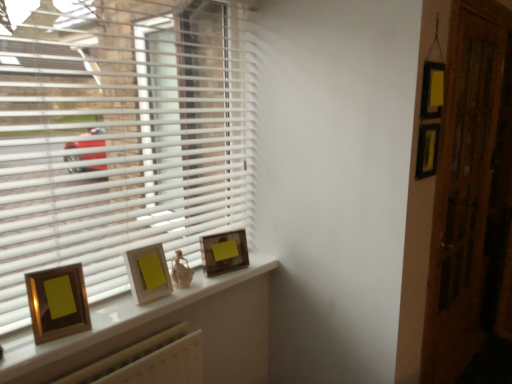
Find the location of a particular element. wooden screen door at right is located at coordinates (471, 192).

In order to face white plastic blinds at left, should I rotate leftwards or rightwards?

Turn left approximately 14.946 degrees to face it.

At what (x,y) coordinates should I click in order to perform the action: click on matte gold picture frame at center, placed as the 3th picture frame when sorted from left to right. Please return your answer as a coordinate pair (x, y). Looking at the image, I should click on (224, 252).

Image resolution: width=512 pixels, height=384 pixels. What do you see at coordinates (58, 302) in the screenshot?
I see `wooden glossy picture frame at left, which is counted as the 3th picture frame, starting from the back` at bounding box center [58, 302].

Identify the location of gold-framed picture at center. (163, 328).

You are a GUI agent. You are given a task and a screenshot of the screen. Output one action in this format:
    pyautogui.click(x=<x>, y=<y>)
    Task: Click on the wooden screen door at right
    The image size is (512, 384).
    Given the screenshot: What is the action you would take?
    pyautogui.click(x=471, y=192)

From a real-world perspective, who is located higher, wooden screen door at right or matte gold picture frame at center, marked as the 2th picture frame in a left-to-right arrangement?

wooden screen door at right.

How much distance is there between wooden screen door at right and matte gold picture frame at center, which appears as the 2th picture frame when viewed from the right?

wooden screen door at right is 1.58 meters from matte gold picture frame at center, which appears as the 2th picture frame when viewed from the right.

Is point (477, 74) positioned after point (134, 256)?

Yes.

Is wooden screen door at right in front of or behind matte gold picture frame at center, which is the 2th picture frame in back-to-front order, in the image?

wooden screen door at right is positioned farther from the viewer than matte gold picture frame at center, which is the 2th picture frame in back-to-front order.

From the image's perspective, which one is positioned higher, matte gold picture frame at center, the first picture frame from the back, or wooden screen door at right?

wooden screen door at right appears higher in the image.

Would you say matte gold picture frame at center, the first picture frame from the back, contains wooden screen door at right?

No, wooden screen door at right is not surrounded by matte gold picture frame at center, the first picture frame from the back.

Who is shorter, matte gold picture frame at center, the first picture frame from the back, or wooden screen door at right?

Standing shorter between the two is matte gold picture frame at center, the first picture frame from the back.

Is matte gold picture frame at center, the first picture frame from the back, not near wooden screen door at right?

That's right, there is a large distance between matte gold picture frame at center, the first picture frame from the back, and wooden screen door at right.

Considering the points (76, 356) and (82, 308), which point is behind, point (76, 356) or point (82, 308)?

Point (82, 308)

From the image's perspective, between gold-framed picture at center and wooden glossy picture frame at left, the 1th picture frame viewed from the front, which one is located above?

From the image's view, wooden glossy picture frame at left, the 1th picture frame viewed from the front, is above.

Is gold-framed picture at center facing towards wooden glossy picture frame at left, which is counted as the first picture frame, starting from the left?

No.

What's the angular difference between gold-framed picture at center and wooden glossy picture frame at left, which is the 3th picture frame from right to left,'s facing directions?

The angular difference between gold-framed picture at center and wooden glossy picture frame at left, which is the 3th picture frame from right to left, is 17.3 degrees.

Which is correct: matte gold picture frame at center, which appears as the 2th picture frame when viewed from the right, is inside white plastic blinds at left, or outside of it?

matte gold picture frame at center, which appears as the 2th picture frame when viewed from the right, is not inside white plastic blinds at left, it's outside.

Measure the distance from matte gold picture frame at center, which is the 2th picture frame in back-to-front order, to white plastic blinds at left.

A distance of 45.39 centimeters exists between matte gold picture frame at center, which is the 2th picture frame in back-to-front order, and white plastic blinds at left.

From a real-world perspective, who is located lower, matte gold picture frame at center, which is the 2th picture frame in back-to-front order, or white plastic blinds at left?

In real-world perspective, matte gold picture frame at center, which is the 2th picture frame in back-to-front order, is lower.

Which is more to the right, matte gold picture frame at center, which is the 2th picture frame in back-to-front order, or white plastic blinds at left?

From the viewer's perspective, matte gold picture frame at center, which is the 2th picture frame in back-to-front order, appears more on the right side.

Is matte gold picture frame at center, the first picture frame from the back, taller than white plastic blinds at left?

No, matte gold picture frame at center, the first picture frame from the back, is not taller than white plastic blinds at left.

Are matte gold picture frame at center, which is the 1th picture frame in right-to-left order, and white plastic blinds at left located far from each other?

No, matte gold picture frame at center, which is the 1th picture frame in right-to-left order, is not far from white plastic blinds at left.

You are a GUI agent. You are given a task and a screenshot of the screen. Output one action in this format:
    pyautogui.click(x=<x>, y=<y>)
    Task: Click on the window blind above the matte gold picture frame at center, placed as the 3th picture frame when sorted from left to right (from the image's perspective)
    
    Given the screenshot: What is the action you would take?
    pyautogui.click(x=120, y=138)

From a real-world perspective, is matte gold picture frame at center, which is the 1th picture frame in right-to-left order, positioned above or below white plastic blinds at left?

In terms of real-world spatial position, matte gold picture frame at center, which is the 1th picture frame in right-to-left order, is below white plastic blinds at left.

Does matte gold picture frame at center, the third picture frame positioned from the front, have a greater width compared to wooden glossy picture frame at left, which is the 3th picture frame from right to left?

Incorrect, the width of matte gold picture frame at center, the third picture frame positioned from the front, does not surpass that of wooden glossy picture frame at left, which is the 3th picture frame from right to left.

Who is taller, matte gold picture frame at center, placed as the 3th picture frame when sorted from left to right, or wooden glossy picture frame at left, which is the 3th picture frame from right to left?

wooden glossy picture frame at left, which is the 3th picture frame from right to left.

From a real-world perspective, is matte gold picture frame at center, which is the 1th picture frame in right-to-left order, under wooden glossy picture frame at left, the 1th picture frame viewed from the front?

Yes, from a real-world perspective, matte gold picture frame at center, which is the 1th picture frame in right-to-left order, is under wooden glossy picture frame at left, the 1th picture frame viewed from the front.

Could you tell me if matte gold picture frame at center, the third picture frame positioned from the front, is turned towards wooden glossy picture frame at left, which is the 3th picture frame from right to left?

No.

In the scene shown: From the image's perspective, which is above, gold-framed picture at center or wooden screen door at right?

wooden screen door at right appears higher in the image.

Can you tell me how much gold-framed picture at center and wooden screen door at right differ in facing direction?

The angle between the facing direction of gold-framed picture at center and the facing direction of wooden screen door at right is 0.568 degrees.

Is gold-framed picture at center thinner than wooden screen door at right?

Incorrect, the width of gold-framed picture at center is not less than that of wooden screen door at right.

Locate an element on the screen. This screenshot has height=384, width=512. screen door located above the matte gold picture frame at center, which appears as the second picture frame when viewed from the front (from the image's perspective) is located at coordinates (471, 192).

From a real-world perspective, count 3rd picture frames downward from the wooden screen door at right and point to it. Please provide its 2D coordinates.

[(224, 252)]

Looking at the image, which one is located closer to white plastic blinds at left, gold-framed picture at center or matte gold picture frame at center, placed as the 3th picture frame when sorted from left to right?

matte gold picture frame at center, placed as the 3th picture frame when sorted from left to right, is positioned closer to the anchor white plastic blinds at left.

When comparing their distances from wooden glossy picture frame at left, the 1th picture frame viewed from the front, does wooden screen door at right or matte gold picture frame at center, the first picture frame from the back, seem closer?

Among the two, matte gold picture frame at center, the first picture frame from the back, is located nearer to wooden glossy picture frame at left, the 1th picture frame viewed from the front.

When comparing their distances from matte gold picture frame at center, which appears as the 2th picture frame when viewed from the right, does matte gold picture frame at center, placed as the 3th picture frame when sorted from left to right, or gold-framed picture at center seem closer?

The object closer to matte gold picture frame at center, which appears as the 2th picture frame when viewed from the right, is gold-framed picture at center.

Based on the photo, looking at the image, which one is located further to matte gold picture frame at center, marked as the 2th picture frame in a left-to-right arrangement, wooden glossy picture frame at left, which is counted as the 3th picture frame, starting from the back, or gold-framed picture at center?

gold-framed picture at center is further to matte gold picture frame at center, marked as the 2th picture frame in a left-to-right arrangement.

From the image, which object appears to be farther from wooden screen door at right, matte gold picture frame at center, which is the 1th picture frame in right-to-left order, or wooden glossy picture frame at left, which is the 3th picture frame from right to left?

wooden glossy picture frame at left, which is the 3th picture frame from right to left, is positioned further to the anchor wooden screen door at right.

Based on their spatial positions, is wooden glossy picture frame at left, the 1th picture frame viewed from the front, or wooden screen door at right closer to gold-framed picture at center?

wooden glossy picture frame at left, the 1th picture frame viewed from the front, lies closer to gold-framed picture at center than the other object.

Based on their spatial positions, is wooden screen door at right or white plastic blinds at left closer to matte gold picture frame at center, which appears as the 2th picture frame when viewed from the right?

Based on the image, white plastic blinds at left appears to be nearer to matte gold picture frame at center, which appears as the 2th picture frame when viewed from the right.

Considering their positions, is matte gold picture frame at center, which appears as the 2th picture frame when viewed from the right, positioned further to gold-framed picture at center than white plastic blinds at left?

Among the two, white plastic blinds at left is located further to gold-framed picture at center.

This screenshot has width=512, height=384. What are the coordinates of `window between white plastic blinds at left and matte gold picture frame at center, the first picture frame from the back, from front to back` in the screenshot? It's located at (163, 328).

Locate an element on the screen. Image resolution: width=512 pixels, height=384 pixels. window situated between matte gold picture frame at center, which appears as the second picture frame when viewed from the front, and wooden screen door at right from left to right is located at coordinates (x=163, y=328).

Image resolution: width=512 pixels, height=384 pixels. What are the coordinates of `window located between wooden glossy picture frame at left, the 1th picture frame viewed from the front, and wooden screen door at right in the left-right direction` in the screenshot? It's located at (163, 328).

The height and width of the screenshot is (384, 512). In order to click on window located between white plastic blinds at left and wooden screen door at right in the left-right direction in this screenshot , I will do `click(163, 328)`.